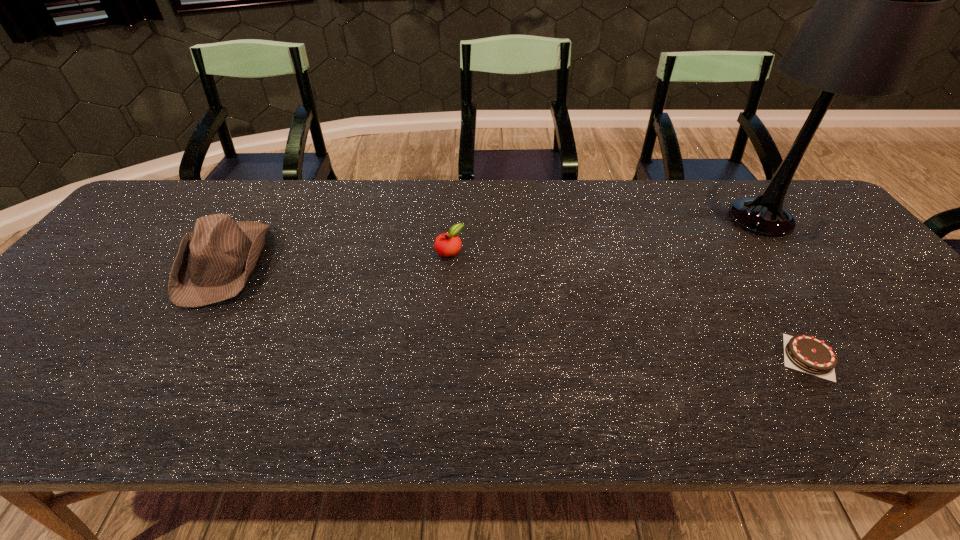
Locate which object is the third closest to the tallest object. Please provide its 2D coordinates. Your answer should be formatted as a tuple, i.e. [(x, y)], where the tuple contains the x and y coordinates of a point satisfying the conditions above.

[(214, 262)]

The width and height of the screenshot is (960, 540). In order to click on the third closest object to the tallest object in this screenshot , I will do `click(214, 262)`.

Where is `free space that satisfies the following two spatial constraints: 1. on the back side of the apple; 2. on the left side of the leftmost object`? The image size is (960, 540). free space that satisfies the following two spatial constraints: 1. on the back side of the apple; 2. on the left side of the leftmost object is located at coordinates (230, 251).